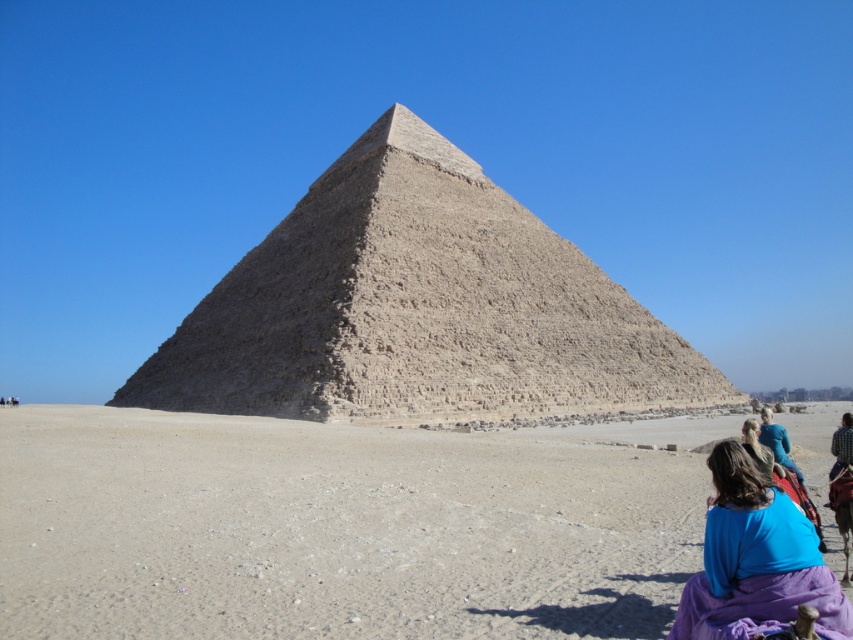
Is brown stone pyramid at center smaller than purple fabric at lower right?

No.

Between brown stone pyramid at center and purple fabric at lower right, which one appears on the left side from the viewer's perspective?

brown stone pyramid at center is more to the left.

Find the location of a particular element. The image size is (853, 640). brown stone pyramid at center is located at coordinates (416, 307).

Between point (97, 602) and point (813, 536), which one is positioned behind?

The point (97, 602) is more distant.

This screenshot has height=640, width=853. What are the coordinates of `brown sandy desert at center` in the screenshot? It's located at (341, 525).

Who is positioned more to the right, brown sandy desert at center or brown stone pyramid at center?

From the viewer's perspective, brown sandy desert at center appears more on the right side.

Does brown sandy desert at center have a larger size compared to brown stone pyramid at center?

No.

Is point (657, 483) positioned in front of point (276, 268)?

Yes, it is.

Find the location of a particular element. This screenshot has width=853, height=640. brown sandy desert at center is located at coordinates (341, 525).